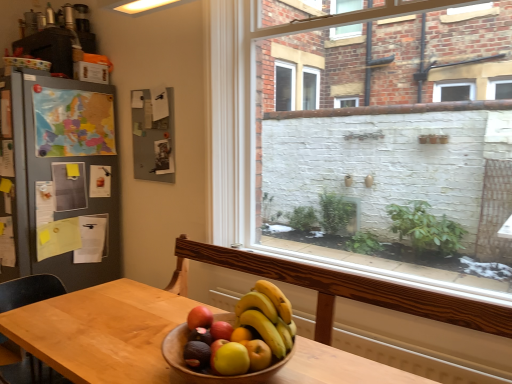
Question: Is matte black cabinet at upper left a part of white brick wall at center?

Choices:
 (A) yes
 (B) no

Answer: (B)

Question: From a real-world perspective, is white brick wall at center physically below matte black cabinet at upper left?

Choices:
 (A) yes
 (B) no

Answer: (A)

Question: Is white brick wall at center not within matte black cabinet at upper left?

Choices:
 (A) yes
 (B) no

Answer: (A)

Question: Could you tell me if white brick wall at center is facing matte black cabinet at upper left?

Choices:
 (A) no
 (B) yes

Answer: (A)

Question: Considering the relative sizes of white brick wall at center and matte black cabinet at upper left in the image provided, is white brick wall at center bigger than matte black cabinet at upper left?

Choices:
 (A) no
 (B) yes

Answer: (B)

Question: Are white brick wall at center and matte black cabinet at upper left far apart?

Choices:
 (A) yes
 (B) no

Answer: (A)

Question: Are red matte apple at center and yellow matte bananas at center far apart?

Choices:
 (A) yes
 (B) no

Answer: (B)

Question: Is yellow matte bananas at center a part of red matte apple at center?

Choices:
 (A) yes
 (B) no

Answer: (B)

Question: Considering the relative sizes of red matte apple at center and yellow matte bananas at center in the image provided, is red matte apple at center taller than yellow matte bananas at center?

Choices:
 (A) yes
 (B) no

Answer: (B)

Question: Is red matte apple at center positioned behind yellow matte bananas at center?

Choices:
 (A) no
 (B) yes

Answer: (B)

Question: From a real-world perspective, is red matte apple at center beneath yellow matte bananas at center?

Choices:
 (A) no
 (B) yes

Answer: (B)

Question: Can you confirm if red matte apple at center is smaller than yellow matte bananas at center?

Choices:
 (A) no
 (B) yes

Answer: (B)

Question: From a real-world perspective, is red matte apple at center on wooden bowl at center?

Choices:
 (A) yes
 (B) no

Answer: (A)